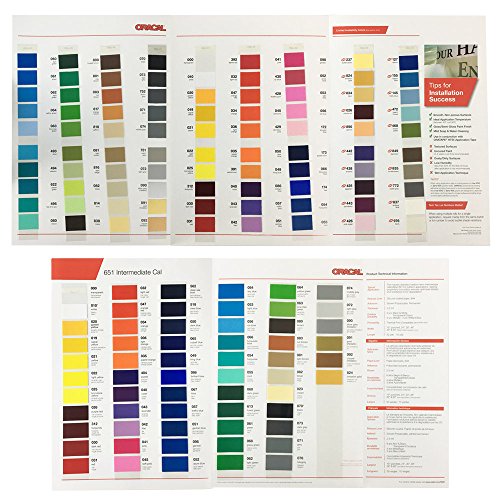
Where is `cream color background`? cream color background is located at coordinates (284, 274), (259, 21).